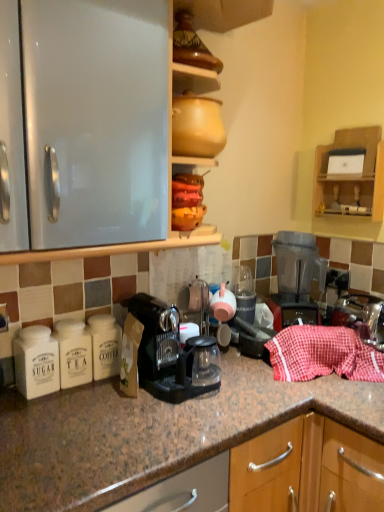
Question: Can you confirm if wooden shelf at upper right is shorter than red checkered cloth at right?

Choices:
 (A) no
 (B) yes

Answer: (A)

Question: Is wooden shelf at upper right taller than red checkered cloth at right?

Choices:
 (A) no
 (B) yes

Answer: (B)

Question: Does wooden shelf at upper right have a larger size compared to red checkered cloth at right?

Choices:
 (A) no
 (B) yes

Answer: (A)

Question: Is wooden shelf at upper right facing towards red checkered cloth at right?

Choices:
 (A) yes
 (B) no

Answer: (B)

Question: Is red checkered cloth at right at the back of wooden shelf at upper right?

Choices:
 (A) no
 (B) yes

Answer: (A)

Question: From the image's perspective, is wooden shelf at upper right positioned above or below red checkered cloth at right?

Choices:
 (A) below
 (B) above

Answer: (B)

Question: In terms of width, does wooden shelf at upper right look wider or thinner when compared to red checkered cloth at right?

Choices:
 (A) wide
 (B) thin

Answer: (B)

Question: Choose the correct answer: Is wooden shelf at upper right inside red checkered cloth at right or outside it?

Choices:
 (A) inside
 (B) outside

Answer: (B)

Question: In terms of height, does wooden shelf at upper right look taller or shorter compared to red checkered cloth at right?

Choices:
 (A) tall
 (B) short

Answer: (A)

Question: In terms of size, does transparent plastic blender at right appear bigger or smaller than red checkered cloth at right?

Choices:
 (A) big
 (B) small

Answer: (A)

Question: Relative to red checkered cloth at right, is transparent plastic blender at right in front or behind?

Choices:
 (A) front
 (B) behind

Answer: (B)

Question: From the image's perspective, is transparent plastic blender at right above or below red checkered cloth at right?

Choices:
 (A) above
 (B) below

Answer: (A)

Question: Based on their positions, is transparent plastic blender at right located to the left or right of red checkered cloth at right?

Choices:
 (A) left
 (B) right

Answer: (A)

Question: From a real-world perspective, is black plastic coffee machine at center physically located above or below transparent plastic blender at right?

Choices:
 (A) above
 (B) below

Answer: (B)

Question: Based on their positions, is black plastic coffee machine at center located to the left or right of transparent plastic blender at right?

Choices:
 (A) left
 (B) right

Answer: (A)